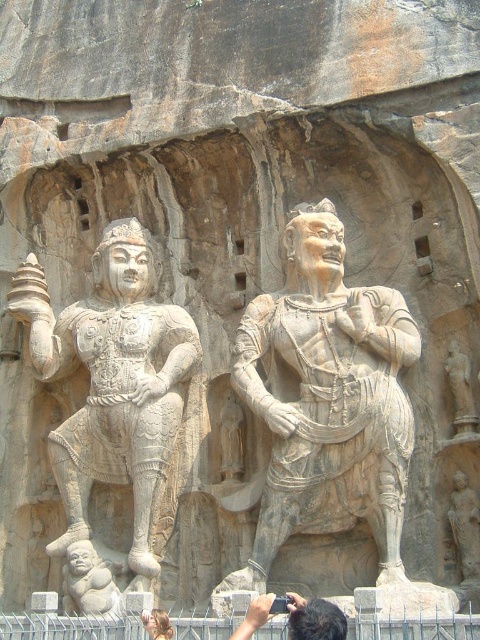
Can you confirm if black hair at lower center is positioned to the right of smooth gray statue at center?

No, black hair at lower center is not to the right of smooth gray statue at center.

Is black hair at lower center behind smooth gray statue at center?

No, black hair at lower center is closer to the viewer.

Between point (261, 625) and point (463, 552), which one is positioned behind?

Point (463, 552)

You are a GUI agent. You are given a task and a screenshot of the screen. Output one action in this format:
    pyautogui.click(x=<x>, y=<y>)
    Task: Click on the black hair at lower center
    The image size is (480, 640).
    Given the screenshot: What is the action you would take?
    pyautogui.click(x=313, y=618)

Which is below, stone warrior at center or white stone warrior at left?

Positioned lower is white stone warrior at left.

Is point (325, 516) closer to viewer compared to point (130, 326)?

Yes, it is.

You are a GUI agent. You are given a task and a screenshot of the screen. Output one action in this format:
    pyautogui.click(x=<x>, y=<y>)
    Task: Click on the stone warrior at center
    This screenshot has height=640, width=480.
    Given the screenshot: What is the action you would take?
    pyautogui.click(x=324, y=401)

Which of these two, white stone warrior at left or smooth stone baby at lower left, stands shorter?

smooth stone baby at lower left is shorter.

Does white stone warrior at left appear on the right side of smooth stone baby at lower left?

In fact, white stone warrior at left is to the left of smooth stone baby at lower left.

Does point (112, 230) come in front of point (82, 579)?

No, (112, 230) is further to viewer.

Image resolution: width=480 pixels, height=640 pixels. In order to click on white stone warrior at left in this screenshot , I will do `click(112, 380)`.